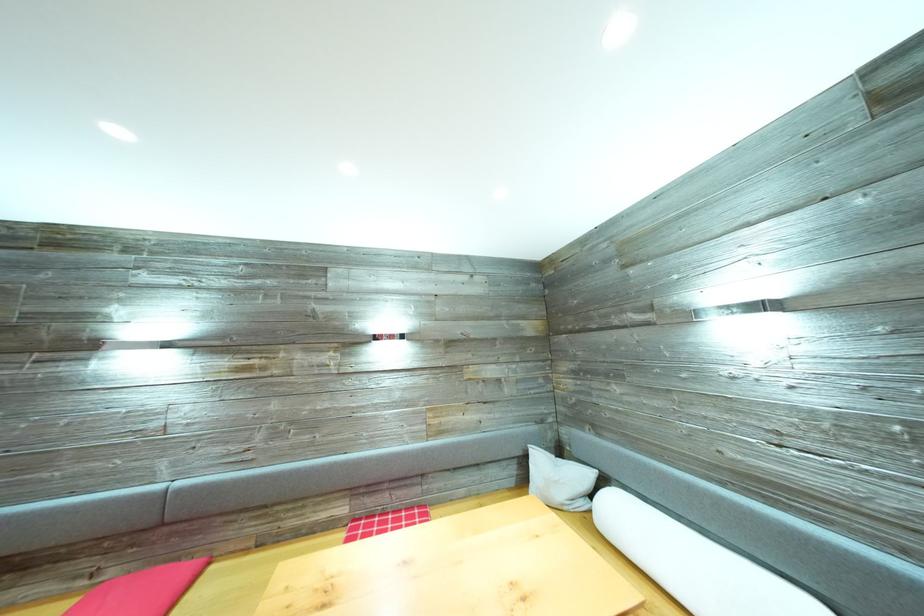
The height and width of the screenshot is (616, 924). What are the coordinates of `white cylindrical pillow` in the screenshot? It's located at (695, 562).